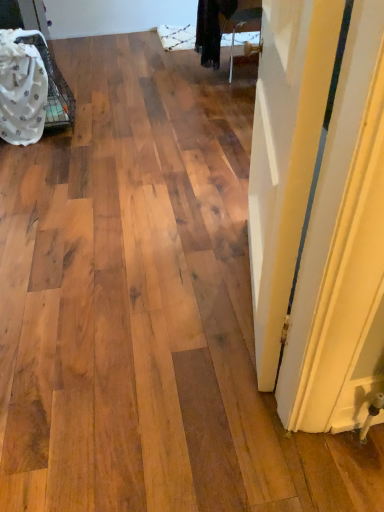
Where is `vacant space in between white fabric at left and white painted wood door at right`? vacant space in between white fabric at left and white painted wood door at right is located at coordinates (132, 186).